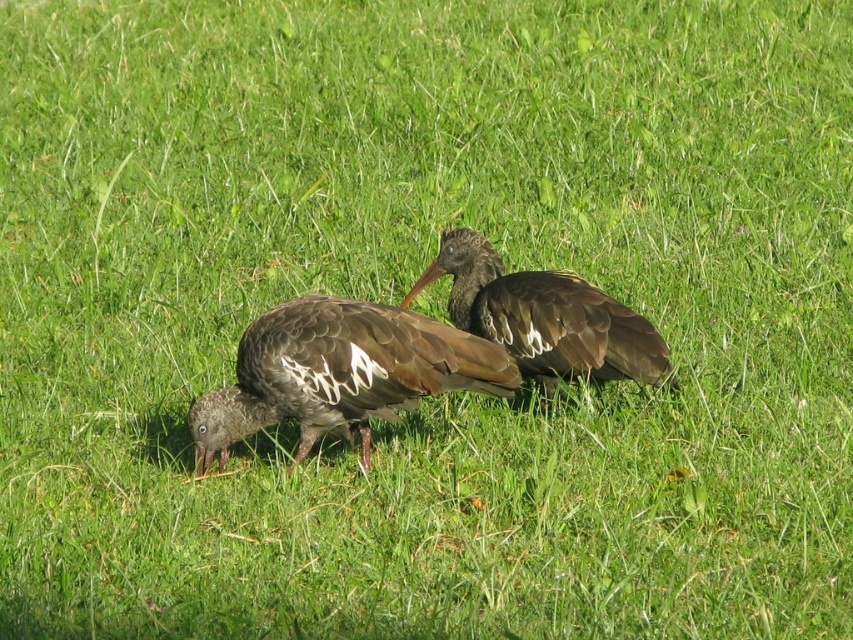
You are a photographer aiming to capture both birds in a single shot. Since you want the brown feathered bird at center and the brown matte bird at center to be clearly visible, which one should you focus on first to ensure sharpness?

You should focus on the brown feathered bird at center first because it is closer to the viewer than the brown matte bird at center, ensuring it remains sharp while the background bird may be slightly blurred.

You are standing in the grassy area and see two birds. The first bird is at point (339, 376) and the second bird is at point (650, 364). Which bird is closer to you?

The bird at point (339, 376) is closer to you because it is in front of the bird at point (650, 364).

You are a photographer trying to capture a closeup of the brown feathered bird at center. Your camera can focus on subjects within 10 feet. Can you take a clear photo without moving closer?

The brown feathered bird at center is 13.37 feet away from the camera, which is beyond the 10 feet focusing range. Therefore, you cannot take a clear photo without moving closer.